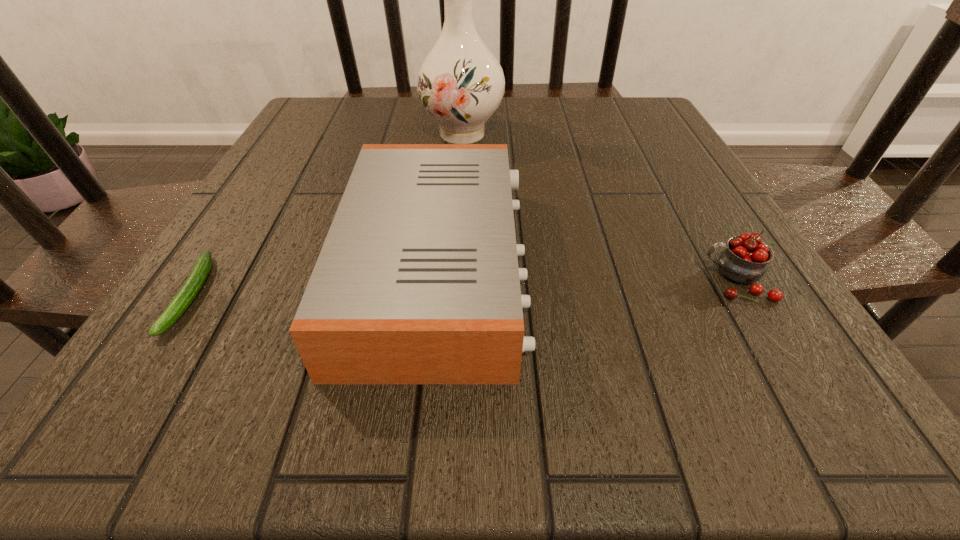
Where is `free region located on the handle side of the rightmost object`? free region located on the handle side of the rightmost object is located at coordinates (624, 280).

The width and height of the screenshot is (960, 540). What are the coordinates of `vacant region located on the front-facing side of the shortest object` in the screenshot? It's located at (116, 411).

Image resolution: width=960 pixels, height=540 pixels. I want to click on object positioned at the far edge, so click(460, 83).

I want to click on object present at the near edge, so click(x=417, y=282).

What are the coordinates of `object at the left edge` in the screenshot? It's located at (184, 297).

Locate an element on the screen. This screenshot has width=960, height=540. object that is at the right edge is located at coordinates (745, 260).

The image size is (960, 540). Find the location of `vacant area at the far edge`. vacant area at the far edge is located at coordinates (421, 113).

Find the location of `free space at the near edge of the desktop`. free space at the near edge of the desktop is located at coordinates (459, 402).

I want to click on free space at the left edge, so click(180, 360).

In the image, there is a desktop. At what (x,y) coordinates should I click in order to perform the action: click on vacant space at the right edge. Please return your answer as a coordinate pair (x, y). The height and width of the screenshot is (540, 960). Looking at the image, I should click on (660, 233).